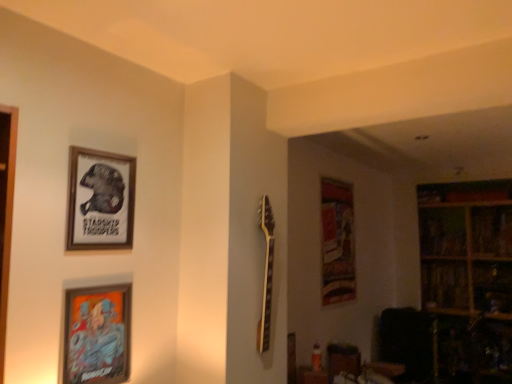
The width and height of the screenshot is (512, 384). I want to click on wooden framed poster at upper left, which ranks as the first picture frame in top-to-bottom order, so click(x=100, y=200).

Measure the distance between point (457,266) and camera.

A: Point (457,266) is 13.39 feet from camera.

Identify the location of wooden bookshelf at upper right, the 2th shelf in the bottom-to-top sequence. (442, 231).

Is wooden bookshelf at right, the first shelf in the bottom-to-top sequence, positioned with its back to metallic silver picture frame at lower left, positioned as the 1th picture frame in bottom-to-top order?

No, metallic silver picture frame at lower left, positioned as the 1th picture frame in bottom-to-top order, is not at the back of wooden bookshelf at right, the first shelf in the bottom-to-top sequence.

Considering the relative sizes of wooden bookshelf at right, the first shelf in the bottom-to-top sequence, and metallic silver picture frame at lower left, positioned as the 1th picture frame in bottom-to-top order, in the image provided, is wooden bookshelf at right, the first shelf in the bottom-to-top sequence, wider than metallic silver picture frame at lower left, positioned as the 1th picture frame in bottom-to-top order,?

Indeed, wooden bookshelf at right, the first shelf in the bottom-to-top sequence, has a greater width compared to metallic silver picture frame at lower left, positioned as the 1th picture frame in bottom-to-top order.

Is wooden framed poster at upper left, which ranks as the first picture frame in top-to-bottom order, at the back of wooden bookshelf at upper right, which is the 1th shelf in top-to-bottom order?

No, wooden framed poster at upper left, which ranks as the first picture frame in top-to-bottom order, is not at the back of wooden bookshelf at upper right, which is the 1th shelf in top-to-bottom order.

From the image's perspective, is wooden bookshelf at upper right, the 2th shelf in the bottom-to-top sequence, under wooden framed poster at upper left, which is the 2th picture frame from bottom to top?

Indeed, from the image's perspective, wooden bookshelf at upper right, the 2th shelf in the bottom-to-top sequence, is shown beneath wooden framed poster at upper left, which is the 2th picture frame from bottom to top.

Is wooden bookshelf at upper right, which is the 1th shelf in top-to-bottom order, at the left side of wooden framed poster at upper left, which ranks as the first picture frame in top-to-bottom order?

No, wooden bookshelf at upper right, which is the 1th shelf in top-to-bottom order, is not to the left of wooden framed poster at upper left, which ranks as the first picture frame in top-to-bottom order.

Which shelf is the 1st one when counting from the right side of the wooden framed poster at upper left, which is the 2th picture frame from bottom to top? Please provide its 2D coordinates.

[(442, 231)]

Is wooden bookshelf at right, the first shelf in the bottom-to-top sequence, next to wooden bookshelf at upper right, which is the 1th shelf in top-to-bottom order?

wooden bookshelf at right, the first shelf in the bottom-to-top sequence, is not next to wooden bookshelf at upper right, which is the 1th shelf in top-to-bottom order, and they're not touching.

From the image's perspective, is wooden bookshelf at right, the first shelf in the bottom-to-top sequence, over wooden bookshelf at upper right, the 2th shelf in the bottom-to-top sequence?

Actually, wooden bookshelf at right, the first shelf in the bottom-to-top sequence, appears below wooden bookshelf at upper right, the 2th shelf in the bottom-to-top sequence, in the image.

Considering the relative sizes of wooden bookshelf at right, the first shelf in the bottom-to-top sequence, and wooden bookshelf at upper right, the 2th shelf in the bottom-to-top sequence, in the image provided, is wooden bookshelf at right, the first shelf in the bottom-to-top sequence, thinner than wooden bookshelf at upper right, the 2th shelf in the bottom-to-top sequence,?

Yes, wooden bookshelf at right, the first shelf in the bottom-to-top sequence, is thinner than wooden bookshelf at upper right, the 2th shelf in the bottom-to-top sequence.

Is wooden framed poster at upper left, which ranks as the first picture frame in top-to-bottom order, not close to wooden bookshelf at upper right, which is the 1th shelf in top-to-bottom order?

Yes, wooden framed poster at upper left, which ranks as the first picture frame in top-to-bottom order, and wooden bookshelf at upper right, which is the 1th shelf in top-to-bottom order, are quite far apart.

Who is taller, wooden framed poster at upper left, which ranks as the first picture frame in top-to-bottom order, or wooden bookshelf at upper right, the 2th shelf in the bottom-to-top sequence?

With more height is wooden bookshelf at upper right, the 2th shelf in the bottom-to-top sequence.

Looking at their sizes, would you say wooden framed poster at upper left, which ranks as the first picture frame in top-to-bottom order, is wider or thinner than wooden bookshelf at upper right, which is the 1th shelf in top-to-bottom order?

Clearly, wooden framed poster at upper left, which ranks as the first picture frame in top-to-bottom order, has less width compared to wooden bookshelf at upper right, which is the 1th shelf in top-to-bottom order.

Is wooden framed poster at upper left, which ranks as the first picture frame in top-to-bottom order, oriented away from wooden bookshelf at upper right, which is the 1th shelf in top-to-bottom order?

wooden framed poster at upper left, which ranks as the first picture frame in top-to-bottom order, does not have its back to wooden bookshelf at upper right, which is the 1th shelf in top-to-bottom order.

Which object is thinner, wooden framed poster at upper left, which ranks as the first picture frame in top-to-bottom order, or wooden bookshelf at right, the second shelf from the top?

With smaller width is wooden framed poster at upper left, which ranks as the first picture frame in top-to-bottom order.

Based on their positions, is wooden framed poster at upper left, which ranks as the first picture frame in top-to-bottom order, located to the left or right of wooden bookshelf at right, the second shelf from the top?

In the image, wooden framed poster at upper left, which ranks as the first picture frame in top-to-bottom order, appears on the left side of wooden bookshelf at right, the second shelf from the top.

Is wooden bookshelf at right, the first shelf in the bottom-to-top sequence, inside wooden framed poster at upper left, which ranks as the first picture frame in top-to-bottom order?

Definitely not — wooden bookshelf at right, the first shelf in the bottom-to-top sequence, is not inside wooden framed poster at upper left, which ranks as the first picture frame in top-to-bottom order.

Is wooden framed poster at upper left, which is the 2th picture frame from bottom to top, further to the viewer compared to wooden bookshelf at right, the second shelf from the top?

No, it is in front of wooden bookshelf at right, the second shelf from the top.

Is wooden bookshelf at right, the first shelf in the bottom-to-top sequence, inside or outside of wooden framed poster at upper left, which is the 2th picture frame from bottom to top?

Result: wooden bookshelf at right, the first shelf in the bottom-to-top sequence, exists outside the volume of wooden framed poster at upper left, which is the 2th picture frame from bottom to top.

Is wooden bookshelf at right, the second shelf from the top, positioned behind wooden framed poster at upper left, which is the 2th picture frame from bottom to top?

Yes, it is.

From the picture: Based on their positions, is wooden bookshelf at right, the second shelf from the top, located to the left or right of wooden framed poster at upper left, which is the 2th picture frame from bottom to top?

In the image, wooden bookshelf at right, the second shelf from the top, appears on the right side of wooden framed poster at upper left, which is the 2th picture frame from bottom to top.

Is wooden bookshelf at right, the second shelf from the top, wider than wooden framed poster at upper left, which is the 2th picture frame from bottom to top?

Yes.

Is point (431, 229) positioned behind point (443, 304)?

Yes, point (431, 229) is behind point (443, 304).

Are wooden bookshelf at upper right, which is the 1th shelf in top-to-bottom order, and wooden bookshelf at right, the first shelf in the bottom-to-top sequence, located far from each other?

No, wooden bookshelf at upper right, which is the 1th shelf in top-to-bottom order, is in close proximity to wooden bookshelf at right, the first shelf in the bottom-to-top sequence.

At what (x,y) coordinates should I click in order to perform the action: click on shelf lying behind the wooden bookshelf at right, the second shelf from the top. Please return your answer as a coordinate pair (x, y). Looking at the image, I should click on (442, 231).

I want to click on the 1st shelf behind the metallic silver picture frame at lower left, positioned as the 1th picture frame in bottom-to-top order, so click(444, 284).

You are a GUI agent. You are given a task and a screenshot of the screen. Output one action in this format:
    pyautogui.click(x=<x>, y=<y>)
    Task: Click on the shelf that is the 1st object to the right of the wooden framed poster at upper left, which ranks as the first picture frame in top-to-bottom order, starting at the anchor
    
    Given the screenshot: What is the action you would take?
    pyautogui.click(x=442, y=231)

Looking at the image, which one is located closer to metallic silver picture frame at lower left, positioned as the 2th picture frame in top-to-bottom order, wooden bookshelf at right, the first shelf in the bottom-to-top sequence, or wooden bookshelf at upper right, which is the 1th shelf in top-to-bottom order?

wooden bookshelf at right, the first shelf in the bottom-to-top sequence.

Based on their spatial positions, is wooden bookshelf at right, the second shelf from the top, or wooden framed poster at upper left, which is the 2th picture frame from bottom to top, further from metallic silver picture frame at lower left, positioned as the 2th picture frame in top-to-bottom order?

wooden bookshelf at right, the second shelf from the top, is further to metallic silver picture frame at lower left, positioned as the 2th picture frame in top-to-bottom order.

Consider the image. Considering their positions, is metallic silver picture frame at lower left, positioned as the 1th picture frame in bottom-to-top order, positioned further to wooden bookshelf at upper right, which is the 1th shelf in top-to-bottom order, than wooden bookshelf at right, the first shelf in the bottom-to-top sequence?

The object further to wooden bookshelf at upper right, which is the 1th shelf in top-to-bottom order, is metallic silver picture frame at lower left, positioned as the 1th picture frame in bottom-to-top order.

Estimate the real-world distances between objects in this image. Which object is further from metallic silver picture frame at lower left, positioned as the 1th picture frame in bottom-to-top order, wooden bookshelf at upper right, which is the 1th shelf in top-to-bottom order, or wooden framed poster at upper left, which ranks as the first picture frame in top-to-bottom order?

wooden bookshelf at upper right, which is the 1th shelf in top-to-bottom order.

Considering their positions, is metallic silver picture frame at lower left, positioned as the 2th picture frame in top-to-bottom order, positioned closer to wooden bookshelf at right, the first shelf in the bottom-to-top sequence, than wooden framed poster at upper left, which ranks as the first picture frame in top-to-bottom order?

Among the two, metallic silver picture frame at lower left, positioned as the 2th picture frame in top-to-bottom order, is located nearer to wooden bookshelf at right, the first shelf in the bottom-to-top sequence.

Looking at this image, which object lies nearer to the anchor point wooden framed poster at upper left, which ranks as the first picture frame in top-to-bottom order, metallic silver picture frame at lower left, positioned as the 2th picture frame in top-to-bottom order, or wooden bookshelf at upper right, the 2th shelf in the bottom-to-top sequence?

The object closer to wooden framed poster at upper left, which ranks as the first picture frame in top-to-bottom order, is metallic silver picture frame at lower left, positioned as the 2th picture frame in top-to-bottom order.

Which object lies nearer to the anchor point wooden bookshelf at right, the first shelf in the bottom-to-top sequence, wooden bookshelf at upper right, which is the 1th shelf in top-to-bottom order, or metallic silver picture frame at lower left, positioned as the 1th picture frame in bottom-to-top order?

wooden bookshelf at upper right, which is the 1th shelf in top-to-bottom order.

When comparing their distances from wooden bookshelf at right, the first shelf in the bottom-to-top sequence, does metallic silver picture frame at lower left, positioned as the 2th picture frame in top-to-bottom order, or wooden bookshelf at upper right, the 2th shelf in the bottom-to-top sequence, seem closer?

The object closer to wooden bookshelf at right, the first shelf in the bottom-to-top sequence, is wooden bookshelf at upper right, the 2th shelf in the bottom-to-top sequence.

I want to click on shelf between wooden framed poster at upper left, which ranks as the first picture frame in top-to-bottom order, and wooden bookshelf at upper right, which is the 1th shelf in top-to-bottom order, in the front-back direction, so click(x=444, y=284).

I want to click on picture frame between metallic silver picture frame at lower left, positioned as the 1th picture frame in bottom-to-top order, and wooden bookshelf at right, the first shelf in the bottom-to-top sequence, in the front-back direction, so click(100, 200).

The width and height of the screenshot is (512, 384). I want to click on shelf between metallic silver picture frame at lower left, positioned as the 2th picture frame in top-to-bottom order, and wooden bookshelf at upper right, the 2th shelf in the bottom-to-top sequence, from front to back, so click(x=444, y=284).

You are a GUI agent. You are given a task and a screenshot of the screen. Output one action in this format:
    pyautogui.click(x=<x>, y=<y>)
    Task: Click on the picture frame between metallic silver picture frame at lower left, positioned as the 1th picture frame in bottom-to-top order, and wooden bookshelf at upper right, the 2th shelf in the bottom-to-top sequence, along the z-axis
    
    Given the screenshot: What is the action you would take?
    pyautogui.click(x=100, y=200)